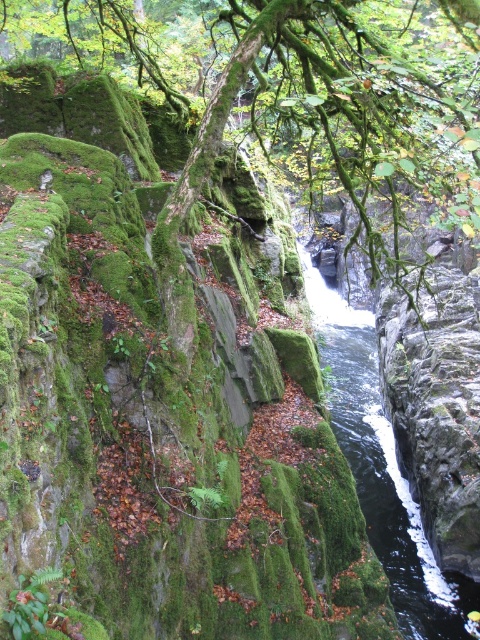
You are a park ranger who needs to retrieve a fallen item from the black glossy water at center. The item is located directly below the green mossy branch at center. Given that you have a 10 meter long rope, can you safely reach the item using the branch as an anchor point?

The distance between the green mossy branch at center and the black glossy water at center is 10.31 meters. Since the rope is only 10 meters long, it is 0.31 meters shorter than required. Therefore, the rope would not be sufficient to safely reach the item.

You are a hiker who needs to cross the black glossy water at center. There is a green mossy branch at center that you can use as a bridge. Can you safely cross using the branch? Explain why based on their widths.

The green mossy branch at center is wider than the black glossy water at center. Since the branch is wider, it should provide a stable surface to cross the water safely.